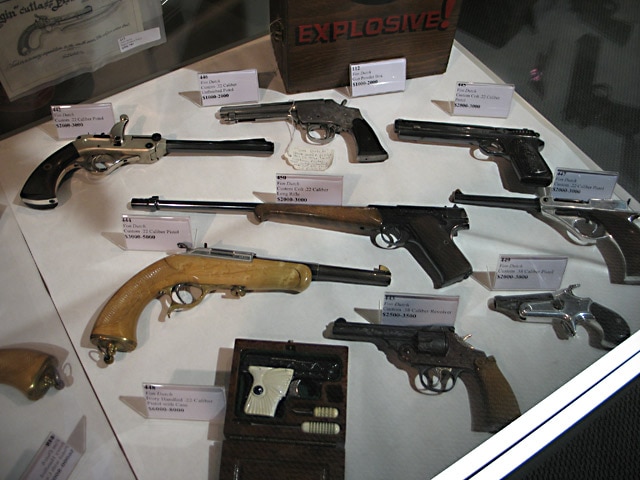
You are a GUI agent. You are given a task and a screenshot of the screen. Output one action in this format:
    pyautogui.click(x=<x>, y=<y>)
    Task: Click on the glass case
    The image size is (640, 480).
    Given the screenshot: What is the action you would take?
    pyautogui.click(x=195, y=18), pyautogui.click(x=605, y=73), pyautogui.click(x=555, y=50)